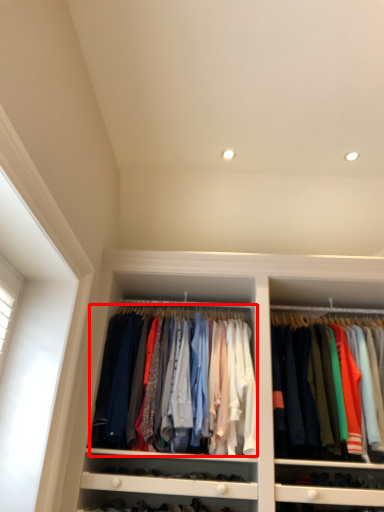
Question: From the image, what is the correct spatial relationship of clothing (annotated by the red box) in relation to clothing?

Choices:
 (A) right
 (B) left

Answer: (B)